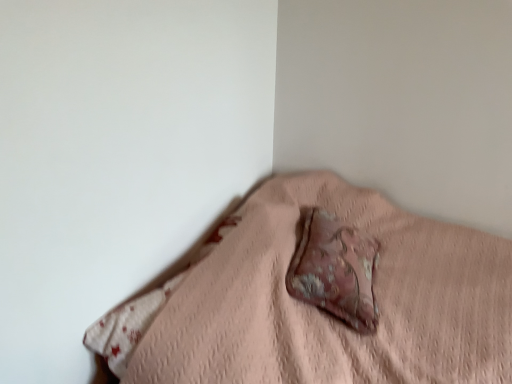
Question: From the image's perspective, is distressed pink fabric pillow at center over pink fabric pillow at center?

Choices:
 (A) no
 (B) yes

Answer: (B)

Question: Could you tell me if distressed pink fabric pillow at center is turned towards pink fabric pillow at center?

Choices:
 (A) yes
 (B) no

Answer: (A)

Question: From a real-world perspective, is distressed pink fabric pillow at center on top of pink fabric pillow at center?

Choices:
 (A) yes
 (B) no

Answer: (A)

Question: Is distressed pink fabric pillow at center to the left of pink fabric pillow at center from the viewer's perspective?

Choices:
 (A) yes
 (B) no

Answer: (A)

Question: Is distressed pink fabric pillow at center shorter than pink fabric pillow at center?

Choices:
 (A) yes
 (B) no

Answer: (A)

Question: Is distressed pink fabric pillow at center facing away from pink fabric pillow at center?

Choices:
 (A) no
 (B) yes

Answer: (B)

Question: Does pink fabric pillow at center have a larger size compared to distressed pink fabric pillow at center?

Choices:
 (A) no
 (B) yes

Answer: (B)

Question: Does pink fabric pillow at center appear on the right side of distressed pink fabric pillow at center?

Choices:
 (A) no
 (B) yes

Answer: (B)

Question: Could you tell me if pink fabric pillow at center is turned towards distressed pink fabric pillow at center?

Choices:
 (A) no
 (B) yes

Answer: (A)

Question: Can you confirm if pink fabric pillow at center is wider than distressed pink fabric pillow at center?

Choices:
 (A) no
 (B) yes

Answer: (B)

Question: From the image's perspective, would you say pink fabric pillow at center is positioned over distressed pink fabric pillow at center?

Choices:
 (A) yes
 (B) no

Answer: (B)

Question: Is pink fabric pillow at center outside of distressed pink fabric pillow at center?

Choices:
 (A) no
 (B) yes

Answer: (B)

Question: From a real-world perspective, is pink fabric pillow at center positioned above or below distressed pink fabric pillow at center?

Choices:
 (A) below
 (B) above

Answer: (A)